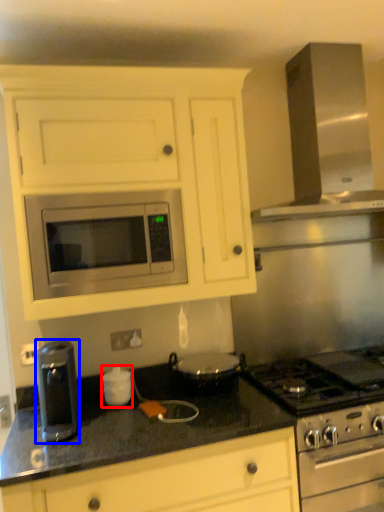
Question: Which point is closer to the camera, appliance (highlighted by a red box) or kitchen appliance (highlighted by a blue box)?

Choices:
 (A) appliance
 (B) kitchen appliance

Answer: (B)